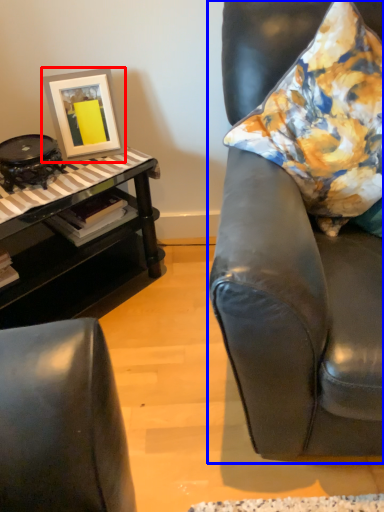
Question: Which object is closer to the camera taking this photo, picture frame (highlighted by a red box) or chair (highlighted by a blue box)?

Choices:
 (A) picture frame
 (B) chair

Answer: (B)